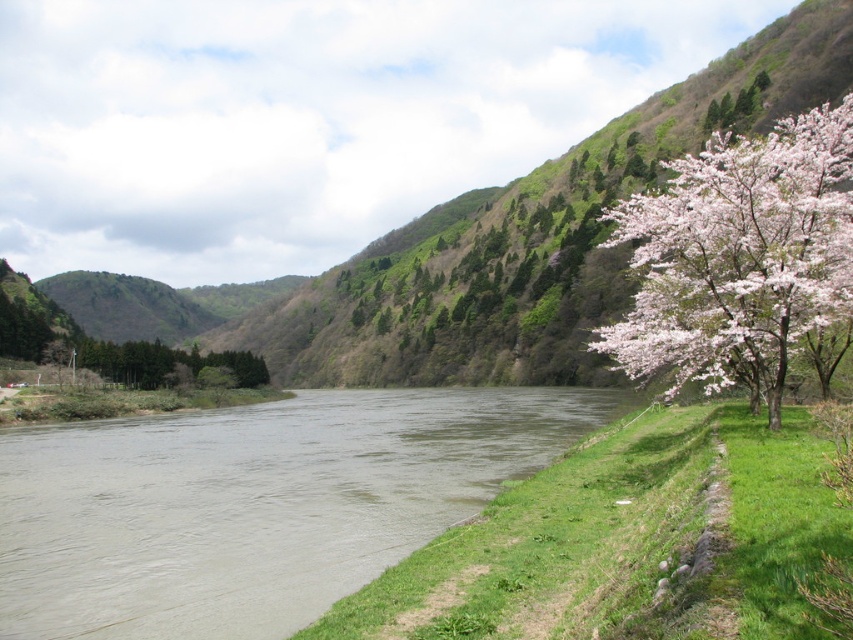
You are standing on the riverbank looking towards the center of the river. You see the brown muddy water at lower left and the pink bloom at right. Which object is closer to your left side?

The brown muddy water at lower left is closer to your left side since it is positioned to the left of the pink bloom at right.

You are standing on the grassy embankment near the riverbank. You see the brown muddy water at lower left and the pink bloom at right. Which object is located lower in the image?

The brown muddy water at lower left is located lower in the image than the pink bloom at right.